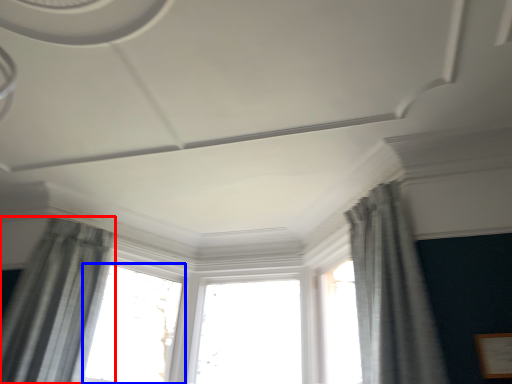
Question: Which object appears farthest to the camera in this image, curtain (highlighted by a red box) or window (highlighted by a blue box)?

Choices:
 (A) curtain
 (B) window

Answer: (B)